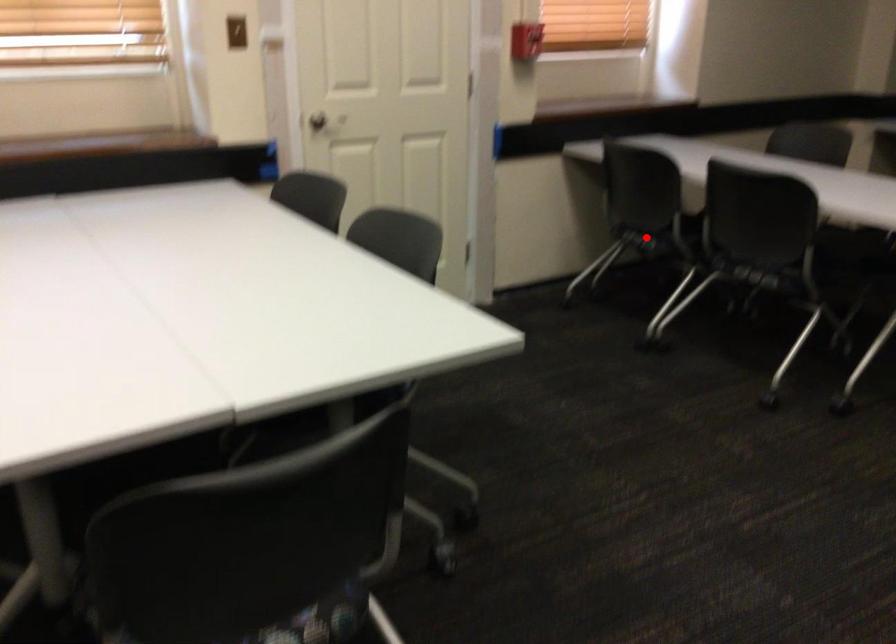
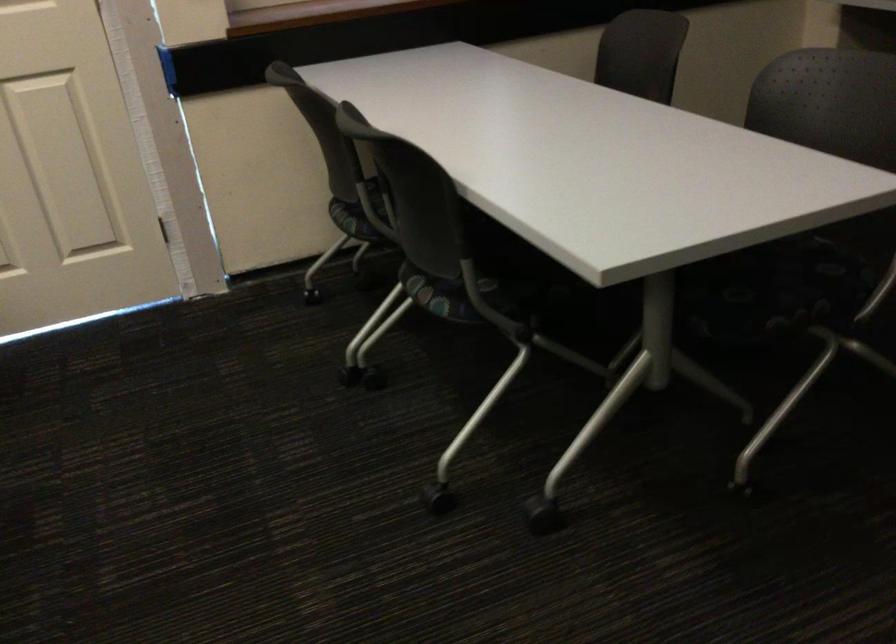
Find the pixel in the second image that matches the highlighted location in the first image.

(350, 220)